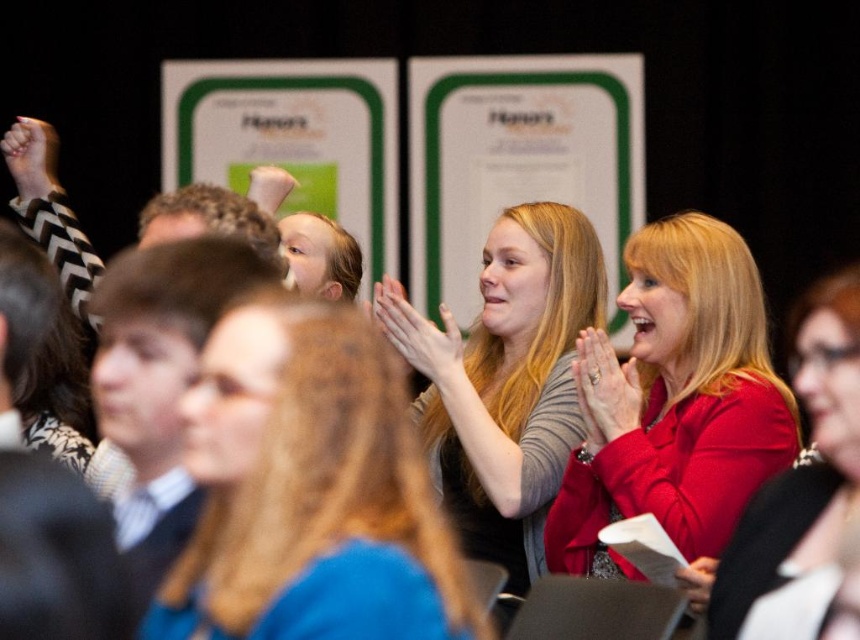
Question: Can you confirm if red satin blouse at center is positioned above smooth skin hand at center?

Choices:
 (A) no
 (B) yes

Answer: (A)

Question: Does smooth skin hand at center appear on the left side of matte black fist at upper left?

Choices:
 (A) yes
 (B) no

Answer: (B)

Question: Does smooth skin hand at center come in front of matte white hand at upper center?

Choices:
 (A) yes
 (B) no

Answer: (A)

Question: Which of the following is the farthest from the observer?

Choices:
 (A) (685, 588)
 (B) (808, 316)
 (C) (309, 282)

Answer: (C)

Question: Among these objects, which one is nearest to the camera?

Choices:
 (A) red satin blouse at center
 (B) matte gold ring at center
 (C) smooth brown hair at center
 (D) matte black paper at center

Answer: (C)

Question: Which object appears closest to the camera in this image?

Choices:
 (A) smooth brown hair at center
 (B) matte black fist at upper left

Answer: (A)